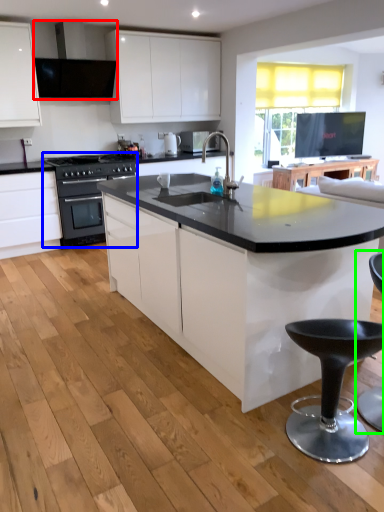
Question: Based on their relative distances, which object is farther from exhaust hood (highlighted by a red box)? Choose from kitchen appliance (highlighted by a blue box) and swivel chair (highlighted by a green box).

Choices:
 (A) kitchen appliance
 (B) swivel chair

Answer: (B)